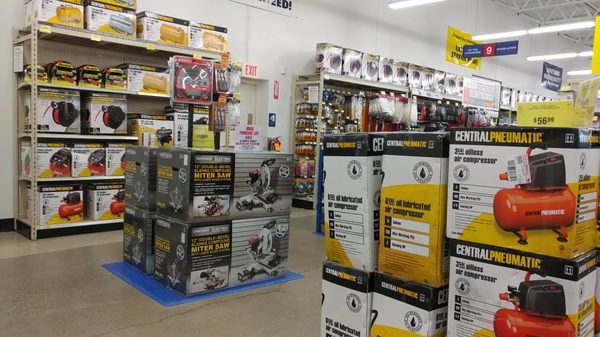
Find the location of a particular element. The height and width of the screenshot is (337, 600). open floor is located at coordinates (66, 288).